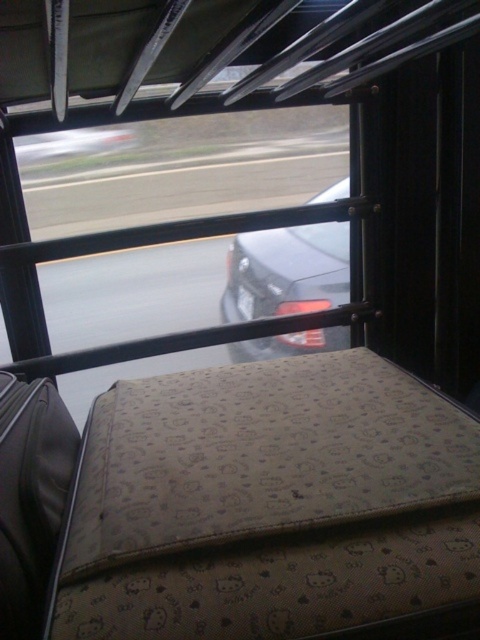
Can you confirm if leather suitcase at lower left is positioned below shiny black car at center?

Indeed, leather suitcase at lower left is positioned under shiny black car at center.

Locate an element on the screen. The image size is (480, 640). leather suitcase at lower left is located at coordinates (31, 497).

Between point (24, 420) and point (302, 273), which one is positioned in front?

Positioned in front is point (24, 420).

The image size is (480, 640). I want to click on leather suitcase at lower left, so click(31, 497).

Is beige fabric suitcase at center closer to the viewer compared to leather suitcase at lower left?

Yes, it is.

Does beige fabric suitcase at center appear on the right side of leather suitcase at lower left?

Yes, beige fabric suitcase at center is to the right of leather suitcase at lower left.

Between point (132, 420) and point (26, 451), which one is positioned in front?

Point (26, 451)

Image resolution: width=480 pixels, height=640 pixels. What are the coordinates of `beige fabric suitcase at center` in the screenshot? It's located at (269, 502).

Between beige fabric suitcase at center and shiny black car at center, which one appears on the right side from the viewer's perspective?

shiny black car at center is more to the right.

Is beige fabric suitcase at center bigger than shiny black car at center?

Correct, beige fabric suitcase at center is larger in size than shiny black car at center.

Locate an element on the screen. Image resolution: width=480 pixels, height=640 pixels. beige fabric suitcase at center is located at coordinates (269, 502).